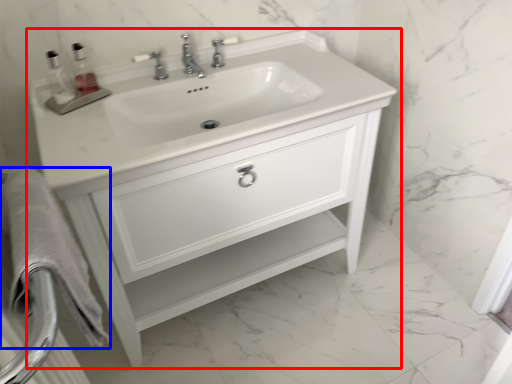
Question: Which object appears closest to the camera in this image, bathroom cabinet (highlighted by a red box) or bath towel (highlighted by a blue box)?

Choices:
 (A) bathroom cabinet
 (B) bath towel

Answer: (B)